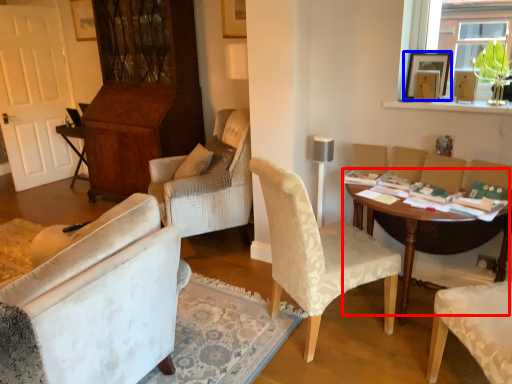
Question: Which object appears farthest to the camera in this image, table (highlighted by a red box) or picture frame (highlighted by a blue box)?

Choices:
 (A) table
 (B) picture frame

Answer: (B)